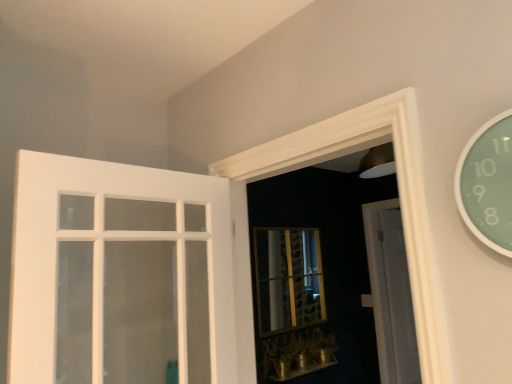
The width and height of the screenshot is (512, 384). Describe the element at coordinates (488, 184) in the screenshot. I see `green glass clock at upper right` at that location.

The width and height of the screenshot is (512, 384). Find the location of `gold textured glass bay window at center`. gold textured glass bay window at center is located at coordinates (288, 279).

The image size is (512, 384). What are the coordinates of `white painted wood door at left, arranged as the 1th door when viewed from the left` in the screenshot? It's located at (119, 274).

Looking at this image, can you confirm if green glass clock at upper right is bigger than gold textured glass bay window at center?

Incorrect, green glass clock at upper right is not larger than gold textured glass bay window at center.

Where is `clock that is above the gold textured glass bay window at center (from a real-world perspective)`? The width and height of the screenshot is (512, 384). clock that is above the gold textured glass bay window at center (from a real-world perspective) is located at coordinates (488, 184).

Is green glass clock at upper right situated inside gold textured glass bay window at center or outside?

green glass clock at upper right is located beyond the bounds of gold textured glass bay window at center.

This screenshot has width=512, height=384. Identify the location of window sill that is below the white painted wood door at left, arranged as the 1th door when viewed from the left (from the image's perspective). (296, 354).

From a real-world perspective, is metallic gold window sill at lower center on top of white painted wood door at left, arranged as the 1th door when viewed from the left?

No.

Would you say metallic gold window sill at lower center is inside or outside white painted wood door at left, arranged as the 1th door when viewed from the left?

metallic gold window sill at lower center exists outside the volume of white painted wood door at left, arranged as the 1th door when viewed from the left.

Between point (314, 366) and point (181, 295), which one is positioned behind?

The point (314, 366) is farther.

Can you see metallic gold window sill at lower center touching white wood door at center, marked as the 2th door in a front-to-back arrangement?

There is a gap between metallic gold window sill at lower center and white wood door at center, marked as the 2th door in a front-to-back arrangement.

Is metallic gold window sill at lower center surrounding white wood door at center, which is the first door in back-to-front order?

No, white wood door at center, which is the first door in back-to-front order, is not a part of metallic gold window sill at lower center.

Does point (285, 376) lie behind point (390, 366)?

No.

Is gold textured glass bay window at center touching white painted wood door at left, acting as the 1th door starting from the front?

No, gold textured glass bay window at center is not touching white painted wood door at left, acting as the 1th door starting from the front.

Is gold textured glass bay window at center bigger than white painted wood door at left, acting as the 1th door starting from the front?

No, gold textured glass bay window at center is not bigger than white painted wood door at left, acting as the 1th door starting from the front.

The height and width of the screenshot is (384, 512). Find the location of `bay window below the white painted wood door at left, arranged as the 1th door when viewed from the left (from the image's perspective)`. bay window below the white painted wood door at left, arranged as the 1th door when viewed from the left (from the image's perspective) is located at coordinates (288, 279).

Considering the relative positions of gold textured glass bay window at center and white painted wood door at left, arranged as the 2th door when viewed from the right, in the image provided, is gold textured glass bay window at center to the left or to the right of white painted wood door at left, arranged as the 2th door when viewed from the right,?

From the image, it's evident that gold textured glass bay window at center is to the right of white painted wood door at left, arranged as the 2th door when viewed from the right.

Considering the positions of point (42, 235) and point (478, 199), is point (42, 235) closer or farther from the camera than point (478, 199)?

Point (42, 235) appears to be farther away from the viewer than point (478, 199).

How different are the orientations of white painted wood door at left, which ranks as the 2th door in back-to-front order, and green glass clock at upper right in degrees?

The facing directions of white painted wood door at left, which ranks as the 2th door in back-to-front order, and green glass clock at upper right are 93.9 degrees apart.

In the scene shown: Between white painted wood door at left, which ranks as the 2th door in back-to-front order, and green glass clock at upper right, which one has larger width?

white painted wood door at left, which ranks as the 2th door in back-to-front order, is wider.

From a real-world perspective, is white painted wood door at left, arranged as the 1th door when viewed from the left, positioned over green glass clock at upper right based on gravity?

No.

Where is `clock that appears on the right of metallic gold window sill at lower center`? This screenshot has width=512, height=384. clock that appears on the right of metallic gold window sill at lower center is located at coordinates (488, 184).

From the image's perspective, is green glass clock at upper right below metallic gold window sill at lower center?

Incorrect, from the image's perspective, green glass clock at upper right is higher than metallic gold window sill at lower center.

Which is more to the left, green glass clock at upper right or metallic gold window sill at lower center?

metallic gold window sill at lower center.

How different are the orientations of white painted wood door at left, arranged as the 1th door when viewed from the left, and gold textured glass bay window at center in degrees?

2.3 degrees separate the facing orientations of white painted wood door at left, arranged as the 1th door when viewed from the left, and gold textured glass bay window at center.

Would you say gold textured glass bay window at center is part of white painted wood door at left, which ranks as the 2th door in back-to-front order,'s contents?

No.

Considering the relative sizes of white painted wood door at left, acting as the 1th door starting from the front, and gold textured glass bay window at center in the image provided, is white painted wood door at left, acting as the 1th door starting from the front, shorter than gold textured glass bay window at center?

No.

The image size is (512, 384). In order to click on bay window below the green glass clock at upper right (from the image's perspective) in this screenshot , I will do `click(288, 279)`.

At what (x,y) coordinates should I click in order to perform the action: click on door that is on the left side of metallic gold window sill at lower center. Please return your answer as a coordinate pair (x, y). This screenshot has height=384, width=512. Looking at the image, I should click on (119, 274).

Estimate the real-world distances between objects in this image. Which object is closer to white painted wood door at left, arranged as the 2th door when viewed from the right, white wood door at center, which is the first door in back-to-front order, or metallic gold window sill at lower center?

metallic gold window sill at lower center.

Estimate the real-world distances between objects in this image. Which object is further from white painted wood door at left, arranged as the 2th door when viewed from the right, metallic gold window sill at lower center or green glass clock at upper right?

green glass clock at upper right is further to white painted wood door at left, arranged as the 2th door when viewed from the right.

From the image, which object appears to be farther from white wood door at center, the first door when ordered from right to left, green glass clock at upper right or metallic gold window sill at lower center?

Among the two, green glass clock at upper right is located further to white wood door at center, the first door when ordered from right to left.

Based on their spatial positions, is green glass clock at upper right or gold textured glass bay window at center closer to white painted wood door at left, arranged as the 2th door when viewed from the right?

gold textured glass bay window at center lies closer to white painted wood door at left, arranged as the 2th door when viewed from the right, than the other object.

From the image, which object appears to be nearer to metallic gold window sill at lower center, gold textured glass bay window at center or green glass clock at upper right?

gold textured glass bay window at center is closer to metallic gold window sill at lower center.

When comparing their distances from green glass clock at upper right, does white painted wood door at left, arranged as the 1th door when viewed from the left, or white wood door at center, which is the first door in back-to-front order, seem further?

white wood door at center, which is the first door in back-to-front order.

From the image, which object appears to be farther from gold textured glass bay window at center, white wood door at center, marked as the 2th door in a front-to-back arrangement, or white painted wood door at left, which ranks as the 2th door in back-to-front order?

The object further to gold textured glass bay window at center is white painted wood door at left, which ranks as the 2th door in back-to-front order.

Which object lies nearer to the anchor point gold textured glass bay window at center, white wood door at center, the second door from the left, or green glass clock at upper right?

white wood door at center, the second door from the left, is closer to gold textured glass bay window at center.

Find the location of a particular element. This screenshot has width=512, height=384. door positioned between green glass clock at upper right and metallic gold window sill at lower center from near to far is located at coordinates (119, 274).

The height and width of the screenshot is (384, 512). Identify the location of window sill between white painted wood door at left, arranged as the 1th door when viewed from the left, and white wood door at center, which is the first door in back-to-front order, along the z-axis. (296, 354).

Locate an element on the screen. This screenshot has height=384, width=512. window sill positioned between green glass clock at upper right and white wood door at center, the second door from the left, from near to far is located at coordinates (296, 354).

Image resolution: width=512 pixels, height=384 pixels. Find the location of `window sill between white painted wood door at left, arranged as the 1th door when viewed from the left, and gold textured glass bay window at center from front to back`. window sill between white painted wood door at left, arranged as the 1th door when viewed from the left, and gold textured glass bay window at center from front to back is located at coordinates (296, 354).